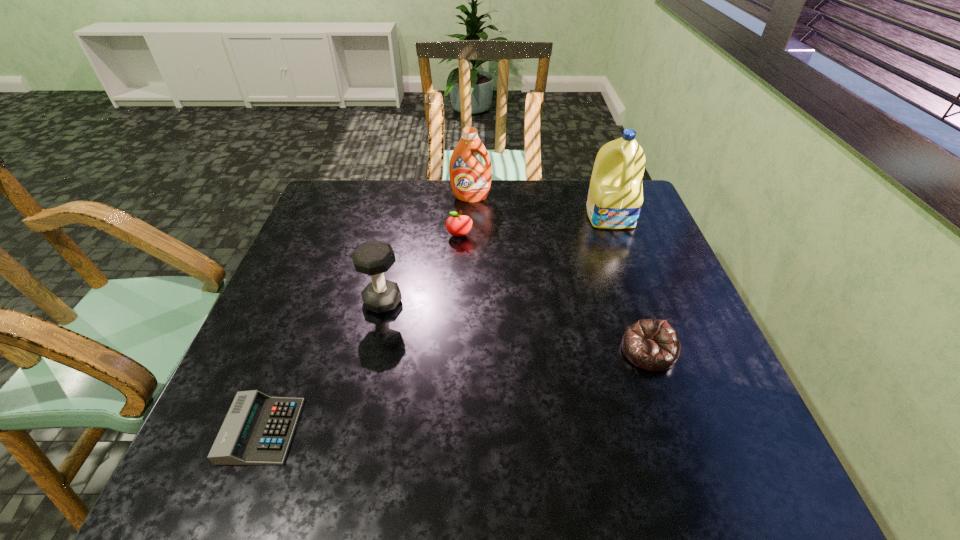
The image size is (960, 540). What are the coordinates of `the second farthest object` in the screenshot? It's located at (615, 197).

Where is `the nearer detergent`? The height and width of the screenshot is (540, 960). the nearer detergent is located at coordinates (615, 197).

The image size is (960, 540). Find the location of `the left detergent`. the left detergent is located at coordinates 470,180.

Where is `the farther detergent`? The image size is (960, 540). the farther detergent is located at coordinates [470, 180].

This screenshot has height=540, width=960. Identify the location of the third nearest object. (373, 258).

You are a GUI agent. You are given a task and a screenshot of the screen. Output one action in this format:
    pyautogui.click(x=<x>, y=<y>)
    Task: Click on the fourth shortest object
    The width and height of the screenshot is (960, 540).
    Given the screenshot: What is the action you would take?
    pyautogui.click(x=373, y=258)

The height and width of the screenshot is (540, 960). I want to click on the third farthest object, so tap(456, 225).

Find the location of a particular element. apple is located at coordinates (456, 225).

Identify the location of the fifth tallest object. (652, 344).

This screenshot has width=960, height=540. I want to click on beanbag, so click(x=652, y=344).